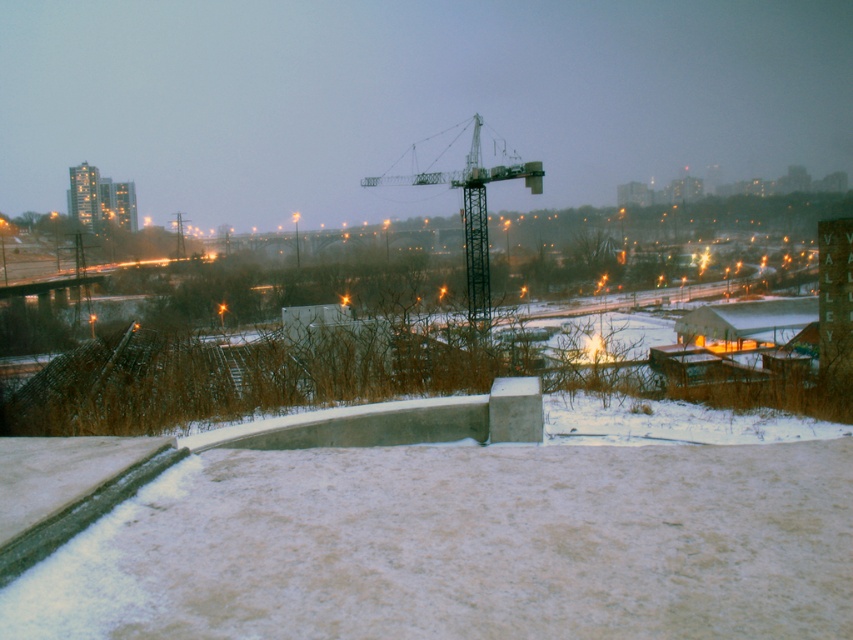
Is white powdery snow at lower center bigger than metallic gray crane at center?

No.

Does white powdery snow at lower center have a greater width compared to metallic gray crane at center?

In fact, white powdery snow at lower center might be narrower than metallic gray crane at center.

Is point (279, 467) less distant than point (491, 176)?

Yes.

Locate an element on the screen. This screenshot has height=640, width=853. white powdery snow at lower center is located at coordinates (462, 545).